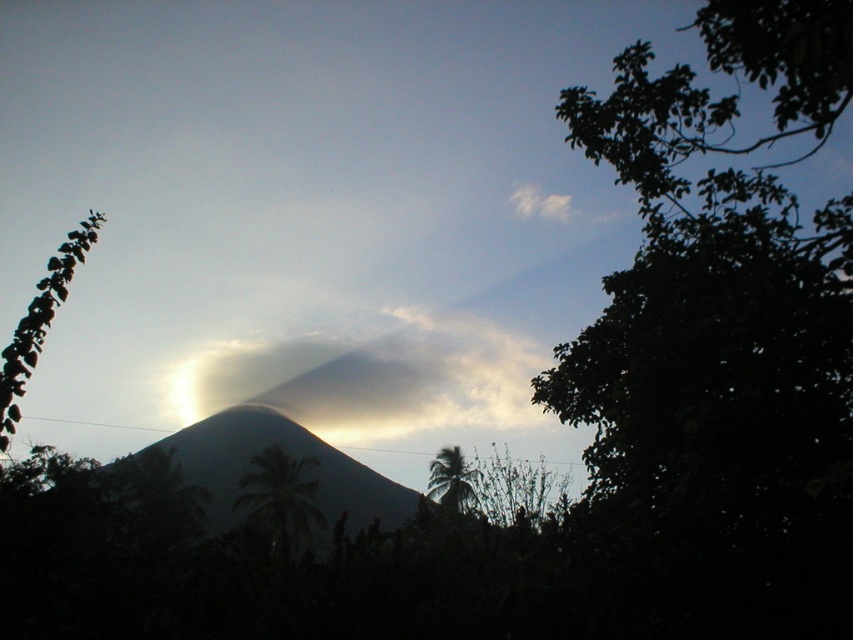
Question: Which object is closer to the camera taking this photo?

Choices:
 (A) green leafy tree at center
 (B) dull gray rock at center

Answer: (A)

Question: Which point is farther to the camera?

Choices:
 (A) smokey gray cloud at center
 (B) green leafy tree at center
 (C) green leafy palm at lower center
 (D) green leafy plant at left

Answer: (A)

Question: Is smokey gray cloud at center smaller than green leafy tree at center?

Choices:
 (A) yes
 (B) no

Answer: (B)

Question: Is smokey gray cloud at center bigger than green leafy palm at lower center?

Choices:
 (A) yes
 (B) no

Answer: (B)

Question: Among these points, which one is farthest from the camera?

Choices:
 (A) (432, 484)
 (B) (76, 248)

Answer: (A)

Question: Does smokey gray cloud at center have a smaller size compared to dull gray rock at center?

Choices:
 (A) no
 (B) yes

Answer: (A)